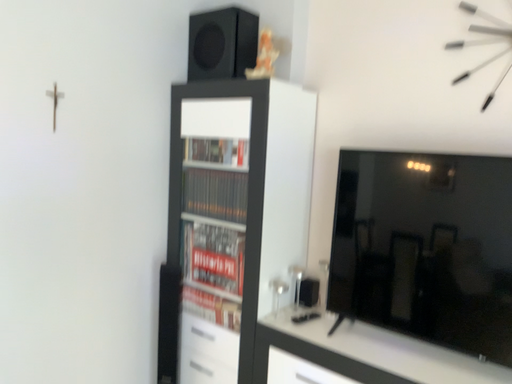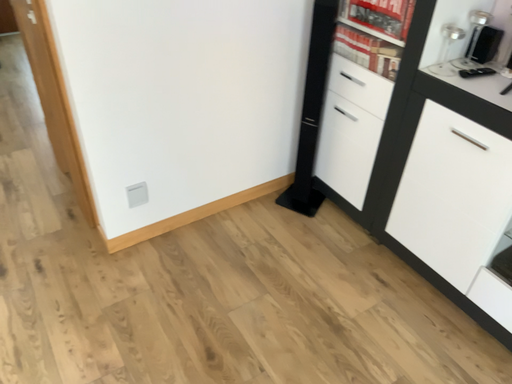
Question: Which way did the camera rotate in the video?

Choices:
 (A) rotated right
 (B) rotated left

Answer: (B)